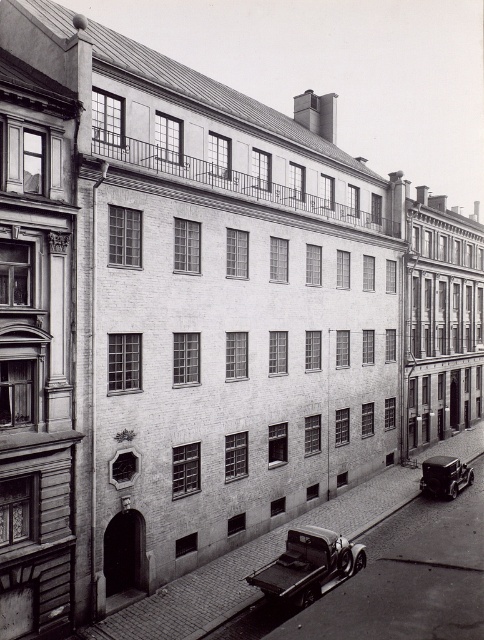
Is point (348, 572) positioned behind point (439, 467)?

No, (348, 572) is closer to viewer.

Identify the location of metallic silver truck at center. The height and width of the screenshot is (640, 484). (308, 564).